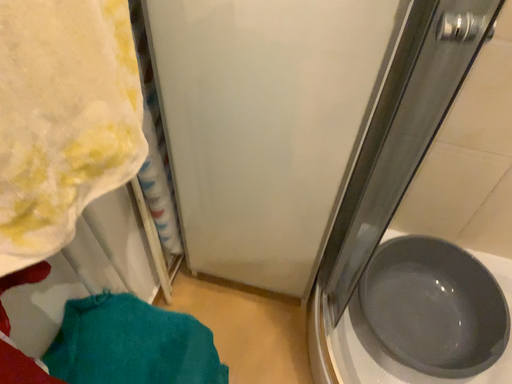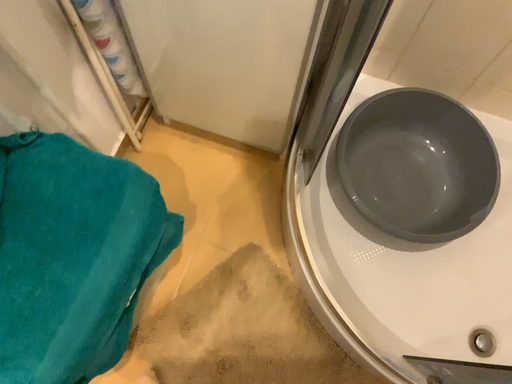
Question: How did the camera likely rotate when shooting the video?

Choices:
 (A) rotated downward
 (B) rotated upward

Answer: (A)